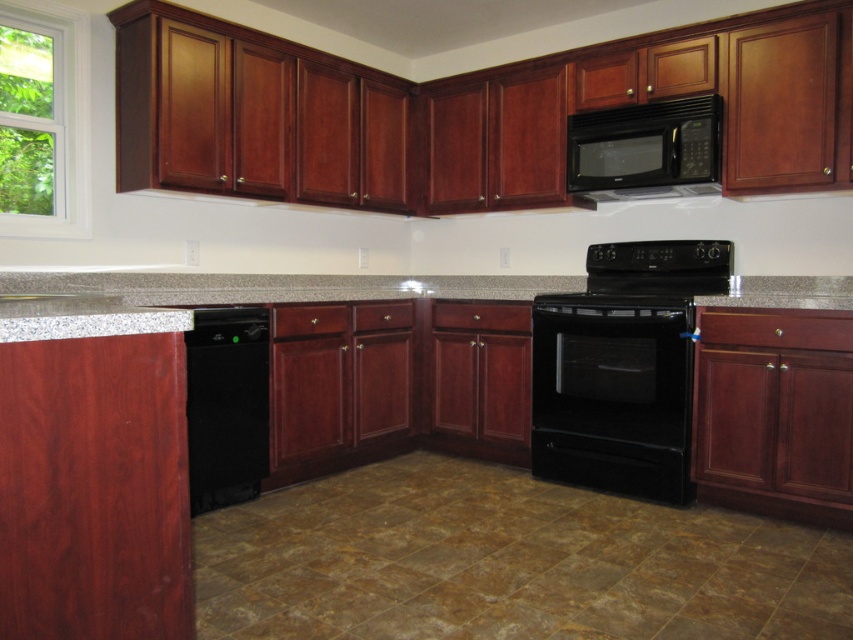
You are a home inspector assessing the kitchen layout. You need to determine if the black matte microwave at upper center is properly installed above the gray granite sink at lower left. According to the image, is the microwave correctly placed over the sink?

The black matte microwave at upper center is positioned over the gray granite sink at lower left, so yes, it is correctly installed above the sink.

You are a delivery person who needs to place a package on the kitchen counter. The package is 3 meters long. Can you fit the package on the counter without bending it? Please explain your reasoning based on the distance from the camera to the black glass oven at center.

The black glass oven at center is 2.93 meters away from the camera. Since the package is 3 meters long, it would extend beyond the visible area of the counter, making it difficult to fit without bending it. The distance from the oven to the camera suggests the counter might not be long enough to accommodate the package.